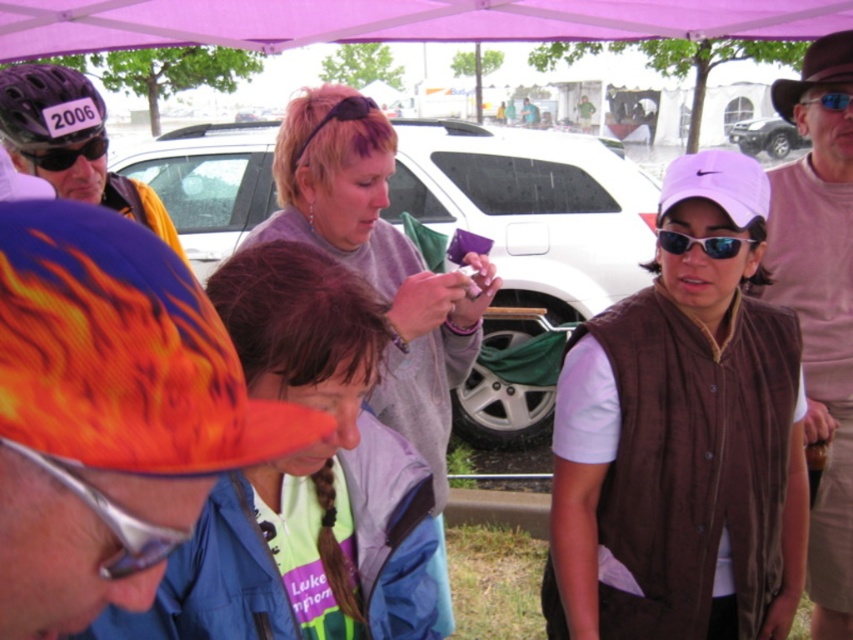
Based on the photo, which of these two, purple fabric canopy at upper center or black plastic goggles at upper left, stands taller?

Standing taller between the two is purple fabric canopy at upper center.

Which is below, purple fabric canopy at upper center or black plastic goggles at upper left?

black plastic goggles at upper left is below.

Is point (103, 16) positioned in front of point (91, 141)?

No.

Find the location of `purple fabric canopy at upper center`. purple fabric canopy at upper center is located at coordinates (393, 20).

Between point (172, 244) and point (849, 100), which one is positioned in front?

Positioned in front is point (849, 100).

What do you see at coordinates (71, 144) in the screenshot? I see `matte black helmet at left` at bounding box center [71, 144].

Where is `matte black helmet at left`? Image resolution: width=853 pixels, height=640 pixels. matte black helmet at left is located at coordinates (71, 144).

Can you confirm if white matte car at center is thinner than purple fabric canopy at upper center?

Yes, white matte car at center is thinner than purple fabric canopy at upper center.

Between white matte car at center and purple fabric canopy at upper center, which one has more height?

Standing taller between the two is white matte car at center.

Which is behind, point (543, 285) or point (509, 26)?

Point (543, 285)

Where is `white matte car at center`? The height and width of the screenshot is (640, 853). white matte car at center is located at coordinates (531, 216).